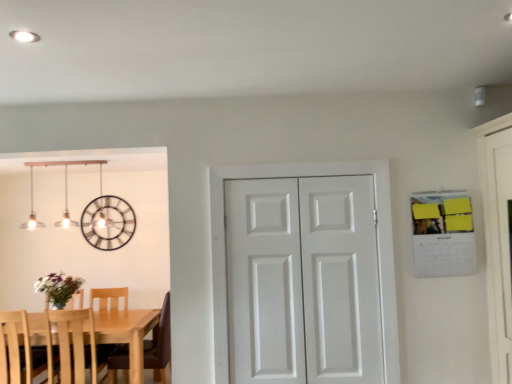
Question: Considering the relative positions of light wood table at lower left and matte silver pendant lights at upper left in the image provided, is light wood table at lower left to the left or to the right of matte silver pendant lights at upper left?

Choices:
 (A) right
 (B) left

Answer: (B)

Question: From a real-world perspective, is light wood table at lower left positioned above or below matte silver pendant lights at upper left?

Choices:
 (A) above
 (B) below

Answer: (B)

Question: Estimate the real-world distances between objects in this image. Which object is closer to the light wood chair at left, the 2th chair when ordered from right to left?

Choices:
 (A) light wood table at lower left
 (B) white matte door at center, the first screen door from the right
 (C) white matte door at center, which is the second screen door from right to left
 (D) white matte door at center
 (E) metallic clock at upper left

Answer: (A)

Question: Based on their relative distances, which object is farther from the metallic clock at upper left?

Choices:
 (A) white matte door at center, which is the second screen door from right to left
 (B) light wood chair at left, the 2th chair in the left-to-right sequence
 (C) matte silver pendant lights at upper left
 (D) light wood chair at left, the first chair when ordered from left to right
 (E) white matte door at center, acting as the 2th screen door starting from the left

Answer: (E)